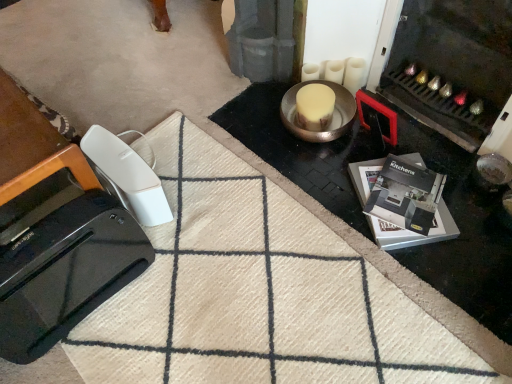
Find the location of a particular element. vacant area located to the right-hand side of black glossy toaster at lower left, the 1th home appliance from the front is located at coordinates (177, 307).